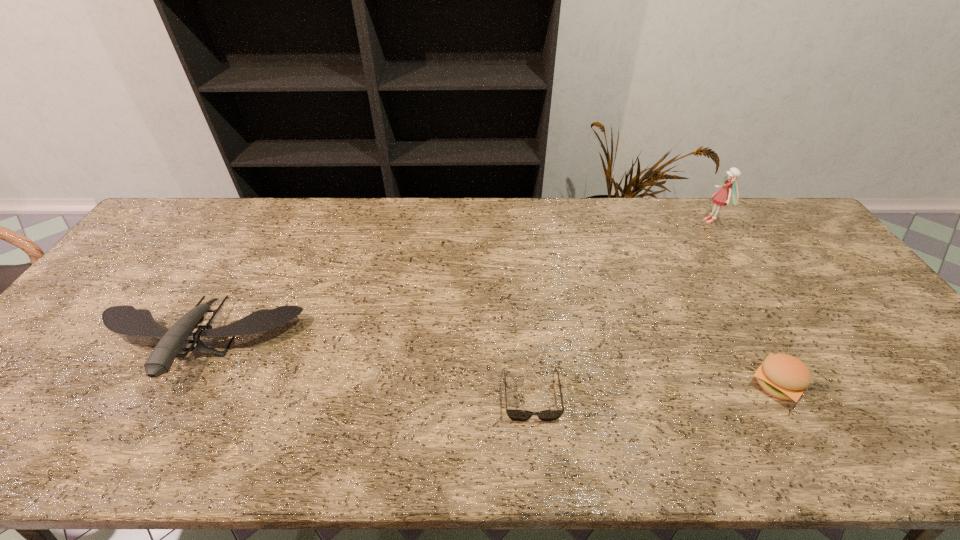
Identify which object is the third nearest to the shortest object. Please provide its 2D coordinates. Your answer should be formatted as a tuple, i.e. [(x, y)], where the tuple contains the x and y coordinates of a point satisfying the conditions above.

[(721, 197)]

What are the coordinates of `free space that satisfies the following two spatial constraints: 1. on the front-facing side of the tallest object; 2. at the front lenses of the third object from right to left` in the screenshot? It's located at (821, 395).

This screenshot has height=540, width=960. What are the coordinates of `vacant space that satisfies the following two spatial constraints: 1. on the front-facing side of the farthest object; 2. at the head of the drone` in the screenshot? It's located at (789, 345).

You are a GUI agent. You are given a task and a screenshot of the screen. Output one action in this format:
    pyautogui.click(x=<x>, y=<y>)
    Task: Click on the vacant space that satisfies the following two spatial constraints: 1. on the front-facing side of the tallest object; 2. at the head of the leftmost object
    The width and height of the screenshot is (960, 540).
    Given the screenshot: What is the action you would take?
    pyautogui.click(x=789, y=345)

The height and width of the screenshot is (540, 960). What are the coordinates of `free space that satisfies the following two spatial constraints: 1. on the front-facing side of the doll; 2. at the front lenses of the shortest object` in the screenshot? It's located at (821, 395).

This screenshot has height=540, width=960. In order to click on free space that satisfies the following two spatial constraints: 1. at the head of the leftmost object; 2. on the left side of the third tallest object in this screenshot , I will do `click(174, 384)`.

Image resolution: width=960 pixels, height=540 pixels. Identify the location of blank area in the image that satisfies the following two spatial constraints: 1. on the front-facing side of the tallest object; 2. at the head of the leftmost object. (789, 345).

You are a GUI agent. You are given a task and a screenshot of the screen. Output one action in this format:
    pyautogui.click(x=<x>, y=<y>)
    Task: Click on the vacant area in the image that satisfies the following two spatial constraints: 1. on the front-facing side of the tallest object; 2. at the front lenses of the sunglasses
    This screenshot has height=540, width=960.
    Given the screenshot: What is the action you would take?
    pyautogui.click(x=821, y=395)